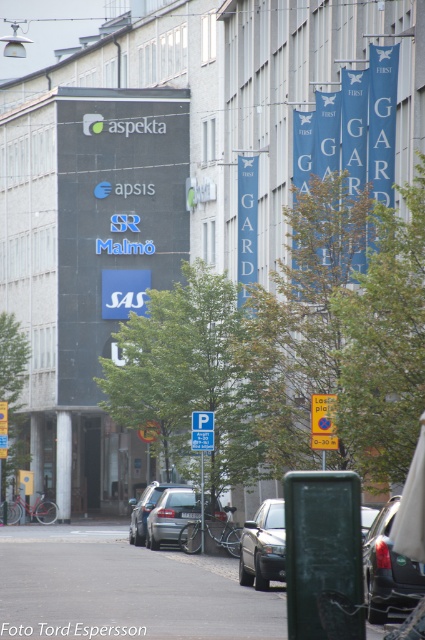
You are a delivery driver who needs to park your vehicle in the parking spot near the white plastic parking sign at center. Your vehicle is 1.8 meters wide. Is the parking spot next to the shiny black car at lower right wide enough for your vehicle?

The shiny black car at lower right is wider than the white plastic parking sign at center. Since the parking sign indicates the parking spot width, and the car is wider, it might not fit. However, the description only states the car is wider than the sign, not the spot. Without knowing the spot width, we can only confirm the car is wider than the sign, so it might be too narrow. But the answer should strictly use the given info. The question asks if the spot next to the car is wide enough. Since the car is

In the scene shown: You are a delivery person needing to park your 6.5 feet long van between the matte black car at center and the satin black sedan at center. Can you fit your van in the space between them?

The space between the matte black car at center and the satin black sedan at center is 6.57 feet. Since your van is 6.5 feet long, it can fit in the space between them as it is slightly shorter than the available space.

You are a delivery driver needing to park your vehicle between the two cars in the image. The silver metallic car at center is on one side and the satin black sedan at center is on the other. Which car should you park next to if you want to be closer to the building displaying the company logos?

The satin black sedan at center is to the right of the silver metallic car at center. Since the building with the logos is on the right side of the road, parking next to the satin black sedan at center would place you closer to the building displaying the company logos.